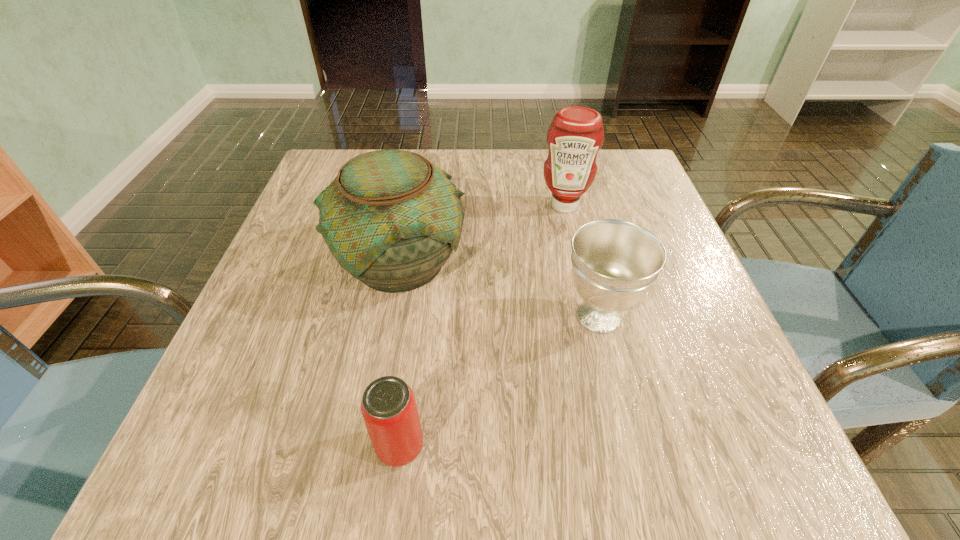
Image resolution: width=960 pixels, height=540 pixels. In order to click on object that is the closest to the chalice in this screenshot , I will do `click(391, 219)`.

At what (x,y) coordinates should I click in order to perform the action: click on free location that satisfies the following two spatial constraints: 1. on the back side of the pottery; 2. on the right side of the farthest object. Please return your answer as a coordinate pair (x, y). Looking at the image, I should click on (411, 205).

I want to click on vacant space that satisfies the following two spatial constraints: 1. on the front side of the chalice; 2. on the left side of the farthest object, so click(x=589, y=316).